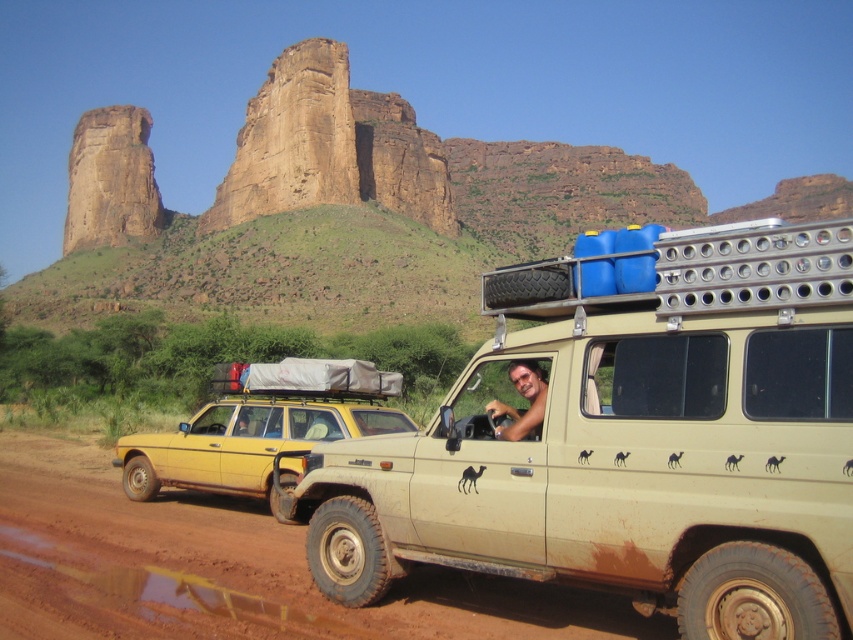
Question: Which point is closer to the camera taking this photo?

Choices:
 (A) (33, 449)
 (B) (804, 456)
 (C) (248, 461)

Answer: (B)

Question: Can you confirm if beige matte suv at center is thinner than smooth tan skin at driver's seat?

Choices:
 (A) no
 (B) yes

Answer: (A)

Question: Can you confirm if brown dirt track at lower left is positioned to the left of smooth tan skin at driver's seat?

Choices:
 (A) yes
 (B) no

Answer: (A)

Question: In this image, where is beige matte suv at center located relative to yellow matte car at left?

Choices:
 (A) below
 (B) above

Answer: (B)

Question: Estimate the real-world distances between objects in this image. Which object is closer to the smooth tan skin at driver's seat?

Choices:
 (A) brown dirt track at lower left
 (B) yellow matte car at left

Answer: (B)

Question: Which is farther from the yellow matte car at left?

Choices:
 (A) beige matte suv at center
 (B) smooth tan skin at driver's seat

Answer: (B)